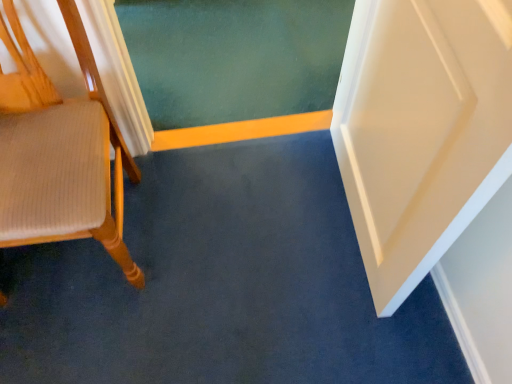
Question: In terms of height, does yellow wood strip at center look taller or shorter compared to wooden chair at left?

Choices:
 (A) short
 (B) tall

Answer: (A)

Question: In the image, is yellow wood strip at center on the left side or the right side of wooden chair at left?

Choices:
 (A) right
 (B) left

Answer: (A)

Question: Based on their sizes in the image, would you say yellow wood strip at center is bigger or smaller than wooden chair at left?

Choices:
 (A) big
 (B) small

Answer: (B)

Question: From the image's perspective, relative to yellow wood strip at center, is wooden chair at left above or below?

Choices:
 (A) above
 (B) below

Answer: (B)

Question: Is point (26, 134) closer or farther from the camera than point (188, 135)?

Choices:
 (A) farther
 (B) closer

Answer: (B)

Question: Based on their sizes in the image, would you say wooden chair at left is bigger or smaller than yellow wood strip at center?

Choices:
 (A) small
 (B) big

Answer: (B)

Question: Would you say wooden chair at left is inside or outside yellow wood strip at center?

Choices:
 (A) inside
 (B) outside

Answer: (B)